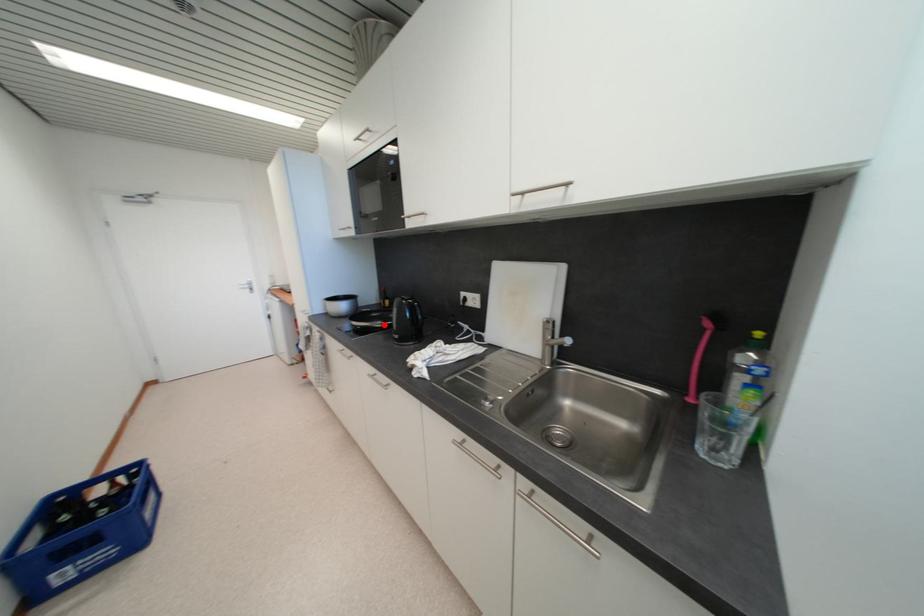
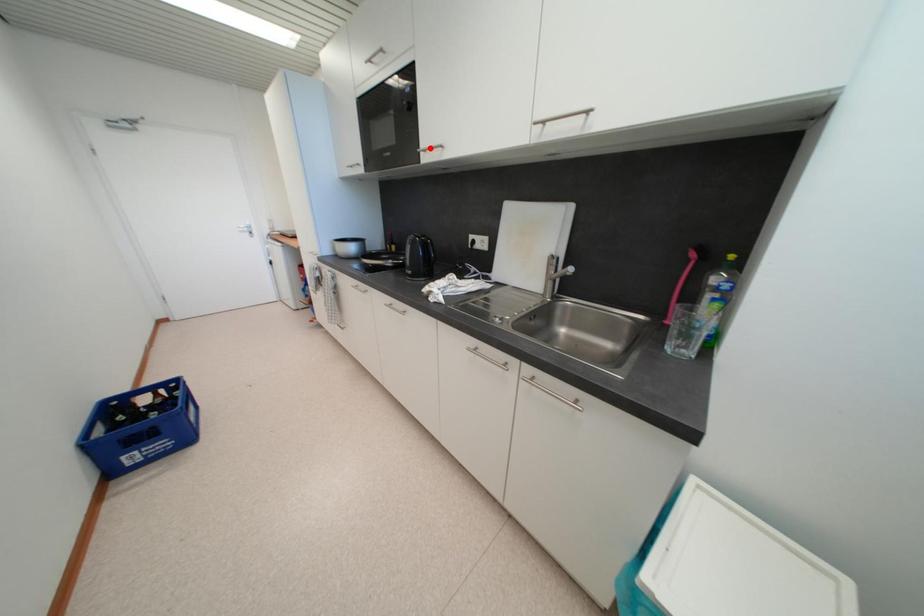
I am providing you with two images of the same scene from different viewpoints. A red point is marked on the first image and another point is marked on the second image. Does the point marked in image1 correspond to the same location as the one in image2?

No